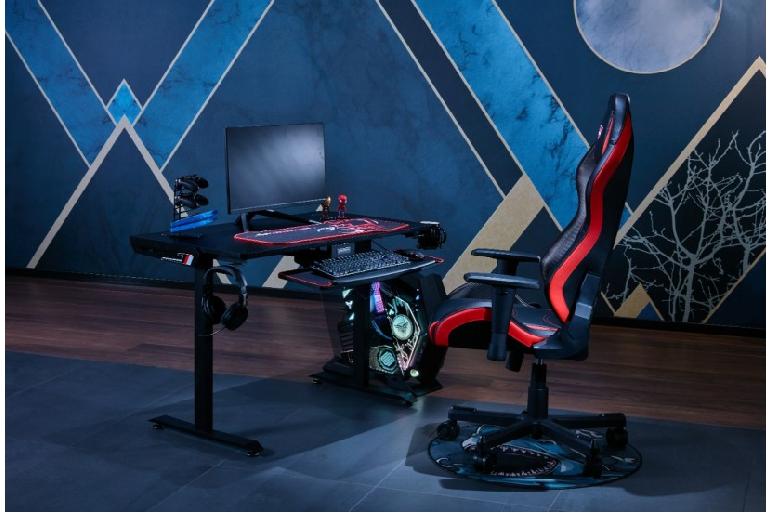
Where is `round moon like painting`? The height and width of the screenshot is (512, 768). round moon like painting is located at coordinates (646, 32).